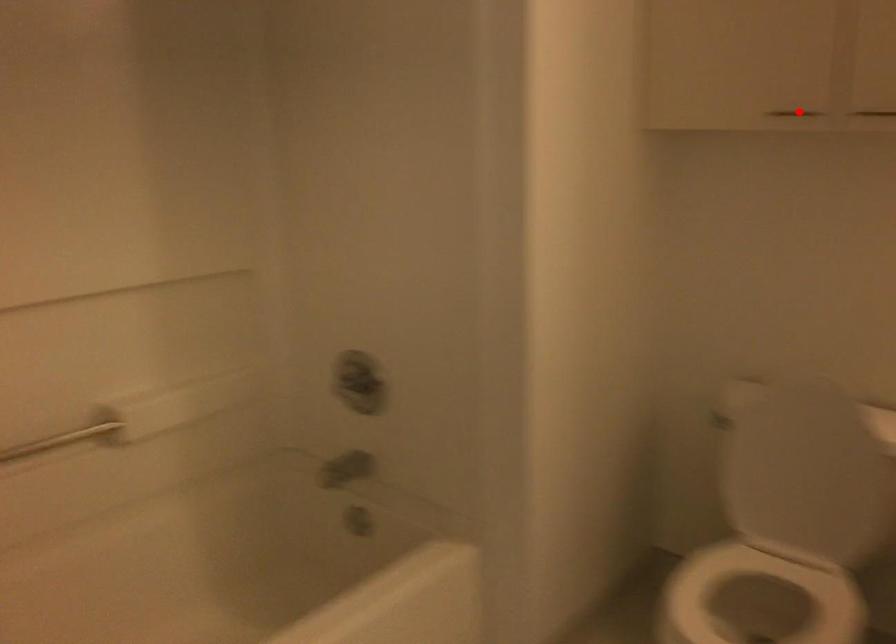
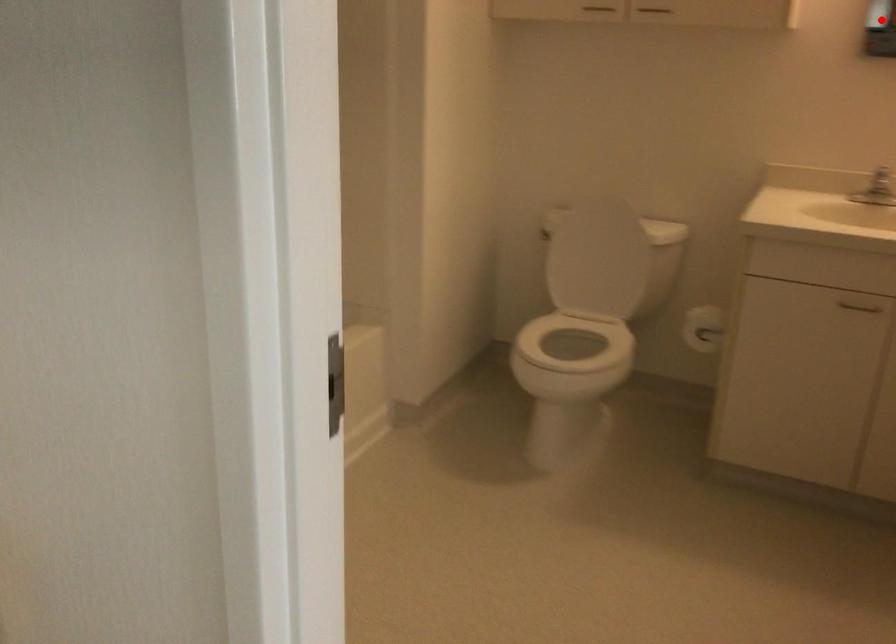
I am providing you with two images of the same scene from different viewpoints. A red point is marked on the first image and another point is marked on the second image. Is the marked point in image1 the same physical position as the marked point in image2?

No